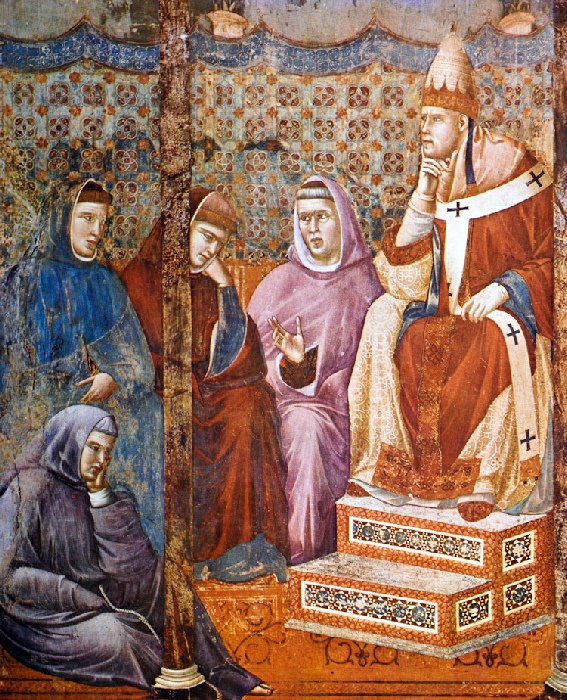
Identify the location of cross sash. This screenshot has width=567, height=700. (513, 336), (527, 439), (533, 174), (456, 206).